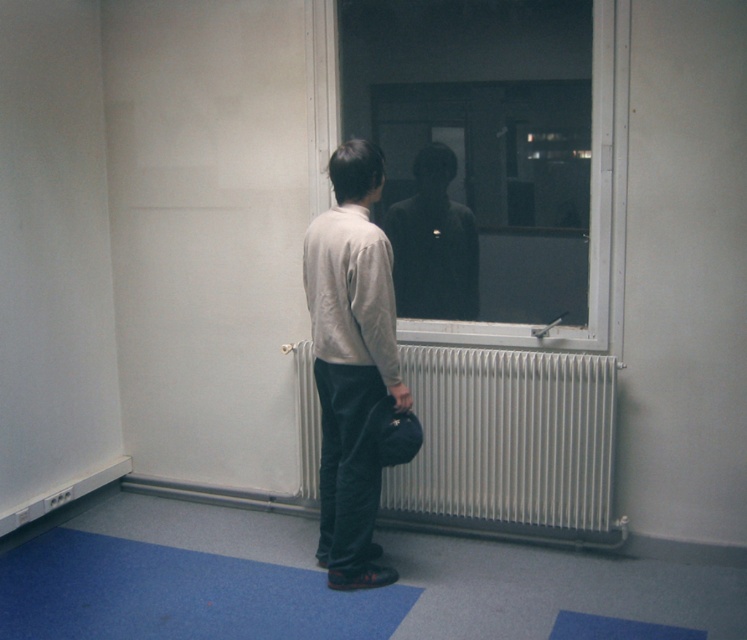
You are an interior designer analyzing the placement of objects in the room. The light beige sweater at center is positioned at coordinates 0.566 on the x axis and 0.471 on the y axis. If the room is a standard 10x10 meter space, what are the sweater location in meters?

The light beige sweater at center is located at approximately 5.66 meters along the x axis and 4.71 meters along the y axis in the room.

You are standing in a room with a transparent glass window at center. If you want to see the reflection of the outside, where should you look on the window?

You should look at point (601,173) on the transparent glass window at center to see the reflection of the outside.